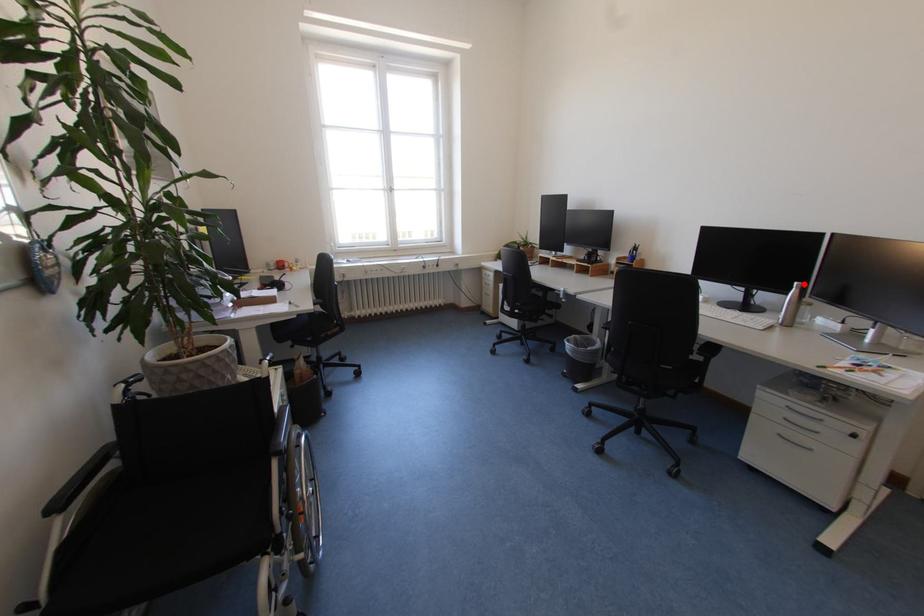
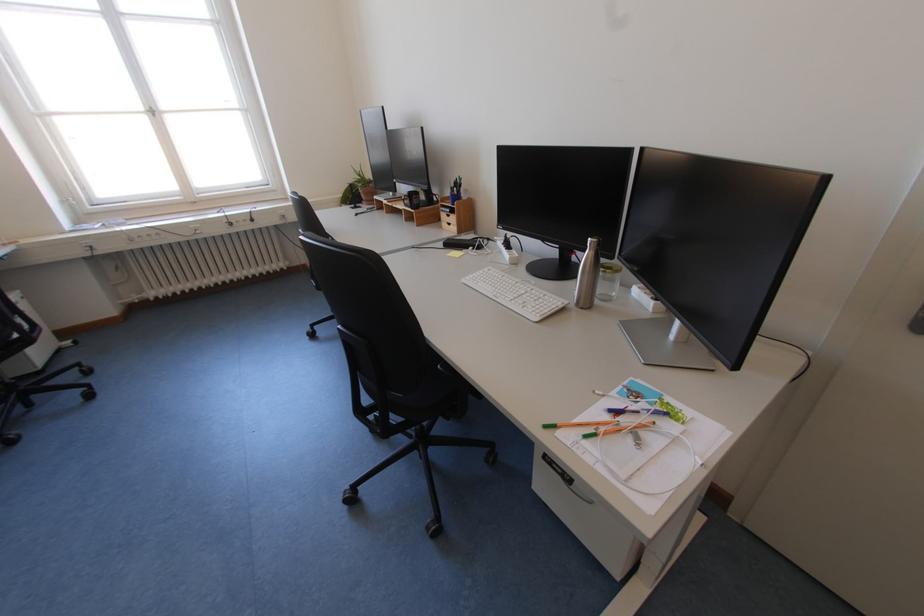
Question: I am providing you with two images of the same scene from different viewpoints. In image1, a red point is highlighted. Considering the same 3D point in image2, which of the following is correct?

Choices:
 (A) It is closer
 (B) It is farther

Answer: (A)